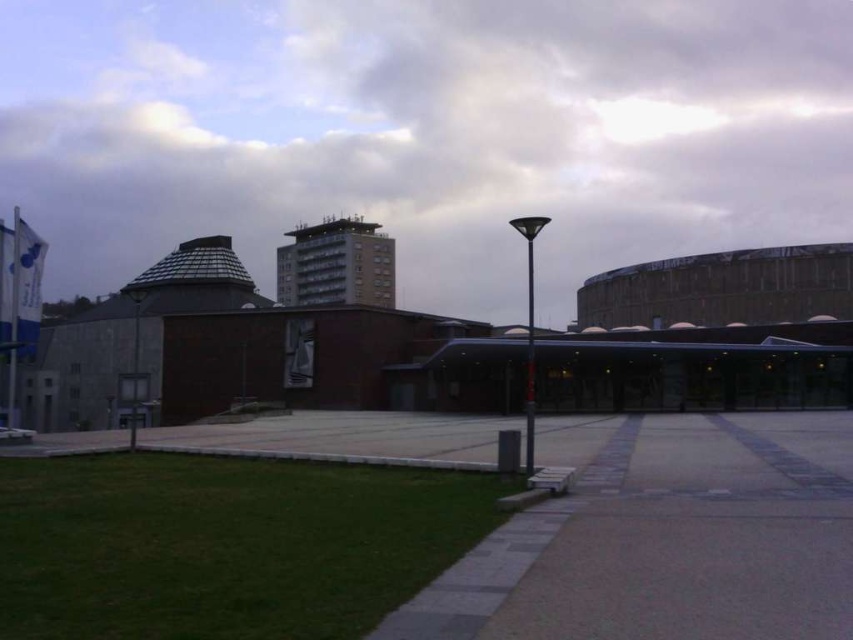
You are a city planner reviewing this urban scene. You need to determine if the white fluffy cloud at upper center is positioned higher than the gray concrete pavement at center. Based on the image, can you confirm this?

Yes, the white fluffy cloud at upper center is above the gray concrete pavement at center, so it is positioned higher.

You are an architect designing a new outdoor plaza. You want to ensure that the gray concrete pavement at center is visible from the white fluffy cloud at upper center. Given their sizes, which object might block the view of the other?

The white fluffy cloud at upper center is larger in size than the gray concrete pavement at center, so it might block the view of the gray concrete pavement at center.

You are a city planner reviewing this urban scene. You need to determine if the white fluffy cloud at upper center and the gray concrete pavement at center can both be included in a scaled model of the area. Since the cloud is much taller than the pavement, will the cloud require a taller structure in the model compared to the pavement?

Yes, the white fluffy cloud at upper center is much taller than the gray concrete pavement at center, so in the scaled model, the cloud structure must be built taller than the pavement to accurately represent their relative heights.